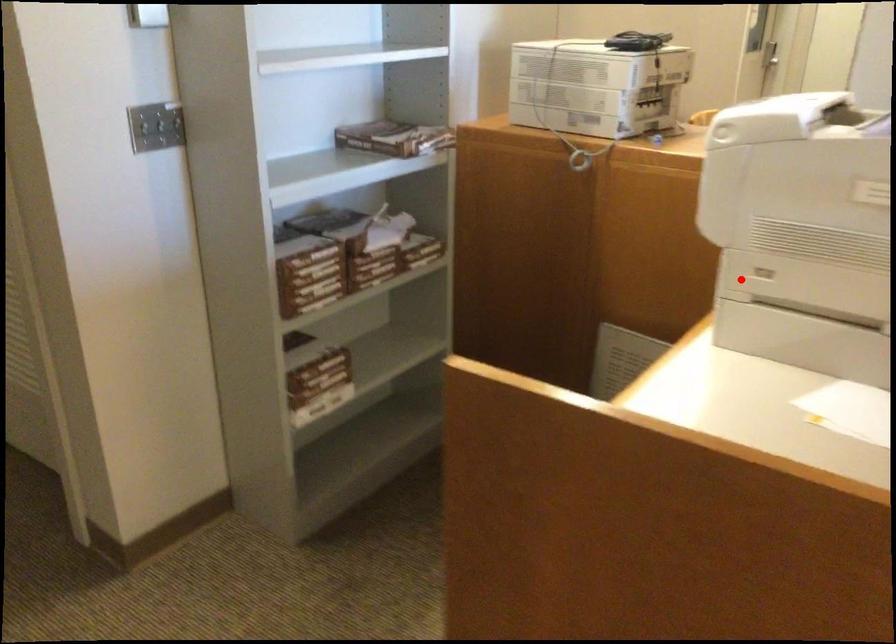
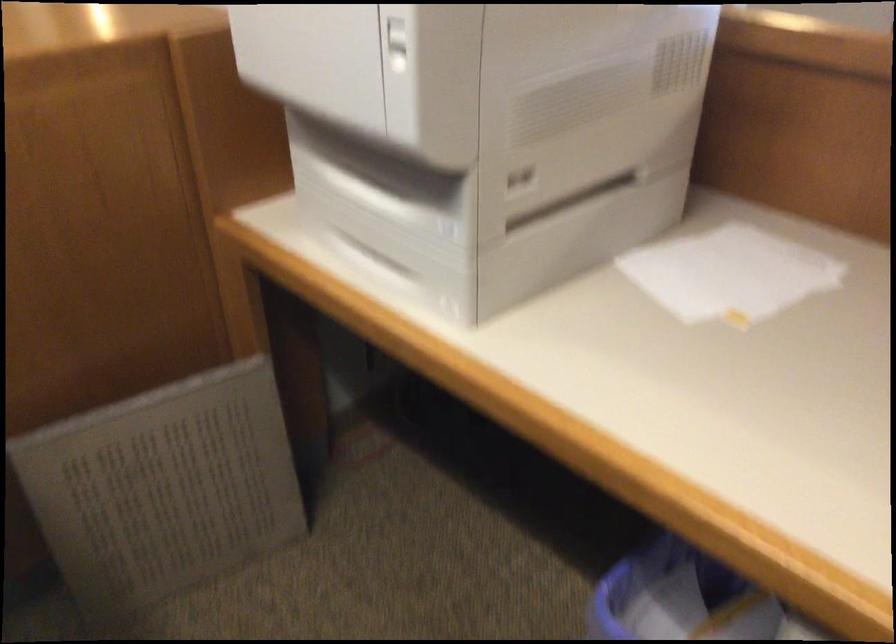
In the second image, find the point that corresponds to the highlighted location in the first image.

(391, 220)